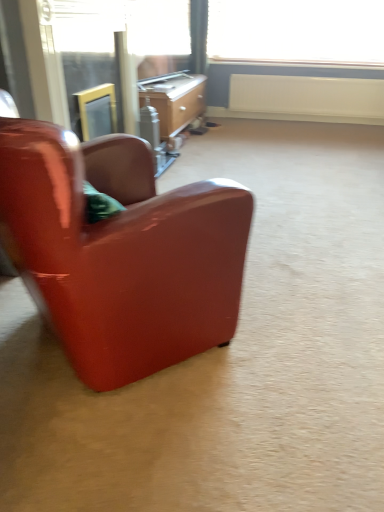
This screenshot has height=512, width=384. In order to click on glossy leather chair at left in this screenshot , I will do `click(121, 252)`.

Locate an element on the screen. white matte radiator at upper center is located at coordinates (307, 99).

The image size is (384, 512). In order to click on screen door behind the clear glass screen door at upper left, positioned as the 2th screen door in left-to-right order in this screenshot , I will do pyautogui.click(x=90, y=77).

Does matte glass screen door at upper left, which is counted as the 1th screen door, starting from the left, have a smaller size compared to clear glass screen door at upper left, positioned as the 2th screen door in left-to-right order?

Correct, matte glass screen door at upper left, which is counted as the 1th screen door, starting from the left, occupies less space than clear glass screen door at upper left, positioned as the 2th screen door in left-to-right order.

Which is behind, matte glass screen door at upper left, which is counted as the 1th screen door, starting from the left, or clear glass screen door at upper left, positioned as the 2th screen door in left-to-right order?

matte glass screen door at upper left, which is counted as the 1th screen door, starting from the left, is more distant.

Is wooden desk at center far from matte glass screen door at upper left, which is counted as the 1th screen door, starting from the left?

No, wooden desk at center is in close proximity to matte glass screen door at upper left, which is counted as the 1th screen door, starting from the left.

In terms of width, does wooden desk at center look wider or thinner when compared to matte glass screen door at upper left, which is counted as the 1th screen door, starting from the left?

wooden desk at center is wider than matte glass screen door at upper left, which is counted as the 1th screen door, starting from the left.

Does wooden desk at center have a greater height compared to matte glass screen door at upper left, the 2th screen door positioned from the right?

In fact, wooden desk at center may be shorter than matte glass screen door at upper left, the 2th screen door positioned from the right.

Is point (145, 101) behind point (104, 53)?

Yes, point (145, 101) is farther from viewer.

From the image's perspective, is matte glass screen door at upper left, the 2th screen door positioned from the right, located above or below white matte radiator at upper center?

Clearly, from the image's perspective, matte glass screen door at upper left, the 2th screen door positioned from the right, is below white matte radiator at upper center.

Consider the image. Can we say matte glass screen door at upper left, which is counted as the 1th screen door, starting from the left, lies outside white matte radiator at upper center?

matte glass screen door at upper left, which is counted as the 1th screen door, starting from the left, lies outside white matte radiator at upper center's area.

Between point (108, 54) and point (371, 105), which one is positioned behind?

Point (371, 105)

Relative to glossy leather chair at left, is wooden desk at center in front or behind?

wooden desk at center is behind glossy leather chair at left.

You are a GUI agent. You are given a task and a screenshot of the screen. Output one action in this format:
    pyautogui.click(x=<x>, y=<y>)
    Task: Click on the desk on the right of glossy leather chair at left
    Image resolution: width=384 pixels, height=512 pixels.
    Given the screenshot: What is the action you would take?
    pyautogui.click(x=174, y=99)

Is wooden desk at center aimed at glossy leather chair at left?

No, wooden desk at center is not oriented towards glossy leather chair at left.

Measure the distance between wooden desk at center and glossy leather chair at left.

2.69 meters.

From a real-world perspective, which object rests below the other?

wooden desk at center, from a real-world perspective.

Who is bigger, white matte radiator at upper center or wooden desk at center?

Bigger between the two is wooden desk at center.

Looking at this image, is white matte radiator at upper center shorter than wooden desk at center?

Indeed, white matte radiator at upper center has a lesser height compared to wooden desk at center.

Based on the photo, is white matte radiator at upper center behind wooden desk at center?

Yes, white matte radiator at upper center is further from the viewer.

Does matte glass screen door at upper left, which is counted as the 1th screen door, starting from the left, lie behind glossy leather chair at left?

Yes, matte glass screen door at upper left, which is counted as the 1th screen door, starting from the left, is further from the camera.

Does matte glass screen door at upper left, which is counted as the 1th screen door, starting from the left, have a lesser width compared to glossy leather chair at left?

Correct, the width of matte glass screen door at upper left, which is counted as the 1th screen door, starting from the left, is less than that of glossy leather chair at left.

From the image's perspective, which one is positioned lower, matte glass screen door at upper left, the 2th screen door positioned from the right, or glossy leather chair at left?

From the image's view, glossy leather chair at left is below.

Considering the sizes of objects matte glass screen door at upper left, the 2th screen door positioned from the right, and glossy leather chair at left in the image provided, who is shorter, matte glass screen door at upper left, the 2th screen door positioned from the right, or glossy leather chair at left?

Standing shorter between the two is matte glass screen door at upper left, the 2th screen door positioned from the right.

In the scene shown: Is white matte radiator at upper center situated inside matte glass screen door at upper left, which is counted as the 1th screen door, starting from the left, or outside?

white matte radiator at upper center is not enclosed by matte glass screen door at upper left, which is counted as the 1th screen door, starting from the left.

Considering the positions of objects white matte radiator at upper center and matte glass screen door at upper left, which is counted as the 1th screen door, starting from the left, in the image provided, who is in front, white matte radiator at upper center or matte glass screen door at upper left, which is counted as the 1th screen door, starting from the left,?

matte glass screen door at upper left, which is counted as the 1th screen door, starting from the left, is closer to the camera.

Are white matte radiator at upper center and matte glass screen door at upper left, which is counted as the 1th screen door, starting from the left, located far from each other?

Absolutely, white matte radiator at upper center is distant from matte glass screen door at upper left, which is counted as the 1th screen door, starting from the left.

You are a GUI agent. You are given a task and a screenshot of the screen. Output one action in this format:
    pyautogui.click(x=<x>, y=<y>)
    Task: Click on the screen door positioned vertically above the matte glass screen door at upper left, the 2th screen door positioned from the right (from a real-world perspective)
    This screenshot has height=512, width=384.
    Given the screenshot: What is the action you would take?
    pyautogui.click(x=88, y=49)

You are a GUI agent. You are given a task and a screenshot of the screen. Output one action in this format:
    pyautogui.click(x=<x>, y=<y>)
    Task: Click on the desk below the matte glass screen door at upper left, the 2th screen door positioned from the right (from a real-world perspective)
    The image size is (384, 512).
    Given the screenshot: What is the action you would take?
    pyautogui.click(x=174, y=99)

Considering their positions, is matte glass screen door at upper left, which is counted as the 1th screen door, starting from the left, positioned further to clear glass screen door at upper left, which is counted as the 1th screen door, starting from the right, than transparent plastic window screen at upper center?

Among the two, transparent plastic window screen at upper center is located further to clear glass screen door at upper left, which is counted as the 1th screen door, starting from the right.

Based on their spatial positions, is clear glass screen door at upper left, positioned as the 2th screen door in left-to-right order, or white matte radiator at upper center closer to transparent plastic window screen at upper center?

white matte radiator at upper center is positioned closer to the anchor transparent plastic window screen at upper center.

Considering their positions, is transparent plastic window screen at upper center positioned closer to matte glass screen door at upper left, which is counted as the 1th screen door, starting from the left, than white matte radiator at upper center?

The object closer to matte glass screen door at upper left, which is counted as the 1th screen door, starting from the left, is white matte radiator at upper center.

When comparing their distances from glossy leather chair at left, does transparent plastic window screen at upper center or wooden desk at center seem closer?

Based on the image, wooden desk at center appears to be nearer to glossy leather chair at left.

Estimate the real-world distances between objects in this image. Which object is further from matte glass screen door at upper left, which is counted as the 1th screen door, starting from the left, clear glass screen door at upper left, which is counted as the 1th screen door, starting from the right, or white matte radiator at upper center?

white matte radiator at upper center is positioned further to the anchor matte glass screen door at upper left, which is counted as the 1th screen door, starting from the left.

From the image, which object appears to be farther from clear glass screen door at upper left, which is counted as the 1th screen door, starting from the right, wooden desk at center or transparent plastic window screen at upper center?

Among the two, transparent plastic window screen at upper center is located further to clear glass screen door at upper left, which is counted as the 1th screen door, starting from the right.

Estimate the real-world distances between objects in this image. Which object is closer to transparent plastic window screen at upper center, glossy leather chair at left or matte glass screen door at upper left, which is counted as the 1th screen door, starting from the left?

The object closer to transparent plastic window screen at upper center is matte glass screen door at upper left, which is counted as the 1th screen door, starting from the left.

Considering their positions, is wooden desk at center positioned closer to matte glass screen door at upper left, the 2th screen door positioned from the right, than transparent plastic window screen at upper center?

wooden desk at center.

The image size is (384, 512). I want to click on desk located between matte glass screen door at upper left, which is counted as the 1th screen door, starting from the left, and transparent plastic window screen at upper center in the depth direction, so click(174, 99).

This screenshot has width=384, height=512. In order to click on desk positioned between clear glass screen door at upper left, positioned as the 2th screen door in left-to-right order, and transparent plastic window screen at upper center from near to far in this screenshot , I will do coord(174,99).

Find the location of `desk between glossy leather chair at left and white matte radiator at upper center along the z-axis`. desk between glossy leather chair at left and white matte radiator at upper center along the z-axis is located at coordinates (174, 99).

The image size is (384, 512). In order to click on desk between matte glass screen door at upper left, which is counted as the 1th screen door, starting from the left, and white matte radiator at upper center, along the z-axis in this screenshot , I will do 174,99.